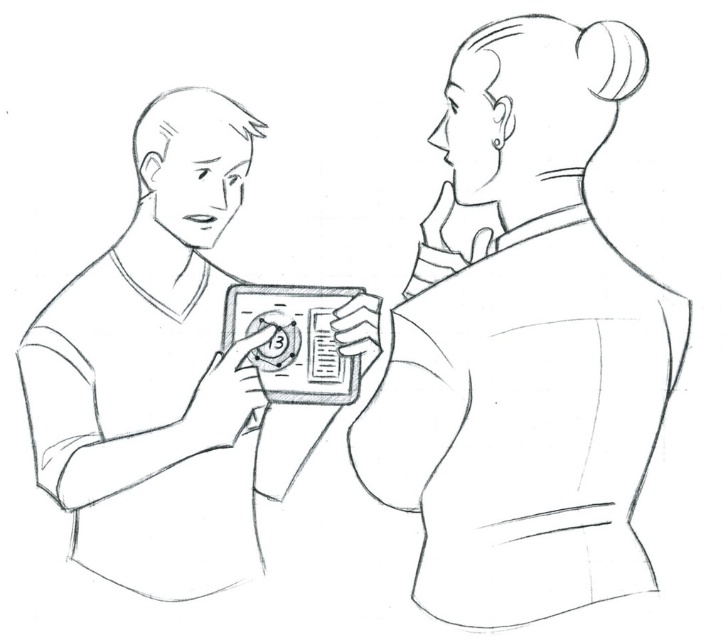
Can you confirm if smooth fabric blouse at upper right is positioned below matte black device at center?

Incorrect, smooth fabric blouse at upper right is not positioned below matte black device at center.

Between smooth fabric blouse at upper right and matte black device at center, which one appears on the left side from the viewer's perspective?

matte black device at center

What do you see at coordinates (523, 342) in the screenshot? This screenshot has width=728, height=640. I see `smooth fabric blouse at upper right` at bounding box center [523, 342].

Where is `smooth fabric blouse at upper right`? smooth fabric blouse at upper right is located at coordinates (523, 342).